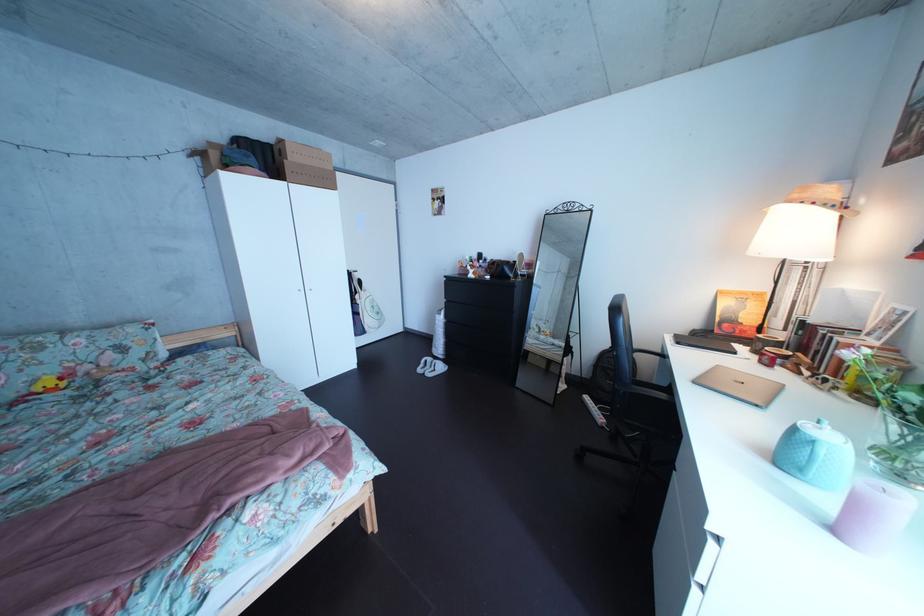
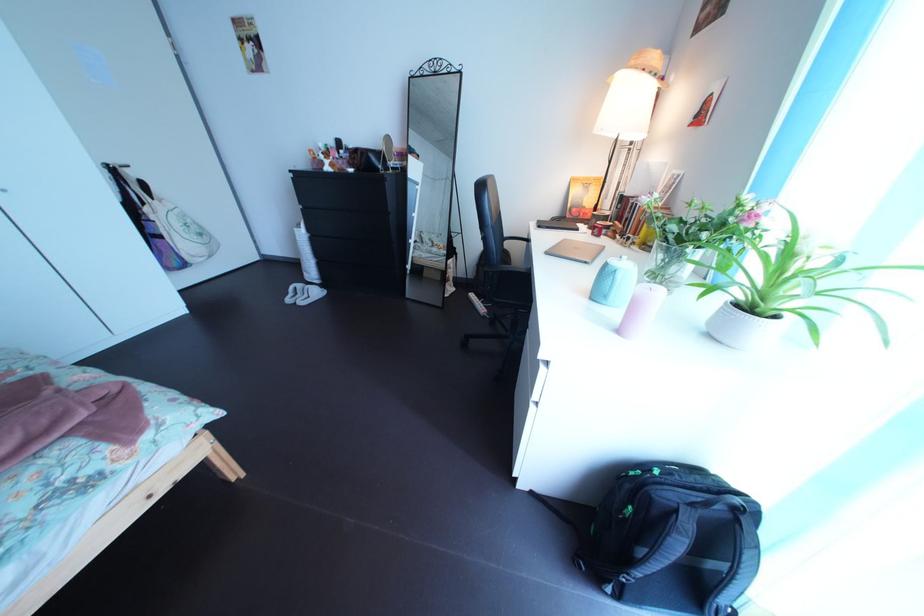
In the scene shown: The images are taken continuously from a first-person perspective. In which direction is your viewpoint rotating?

The camera rotated toward right-down.